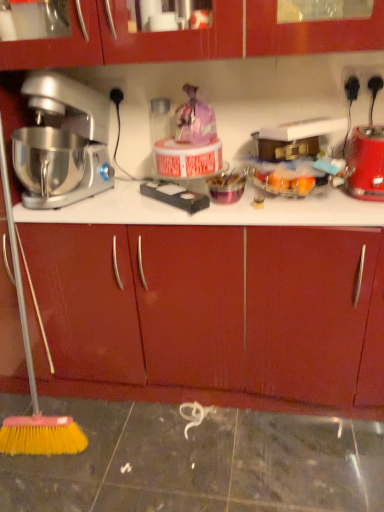
What are the coordinates of `free space above matte wood drawer at center (from a real-world perspective)` in the screenshot? It's located at (210, 202).